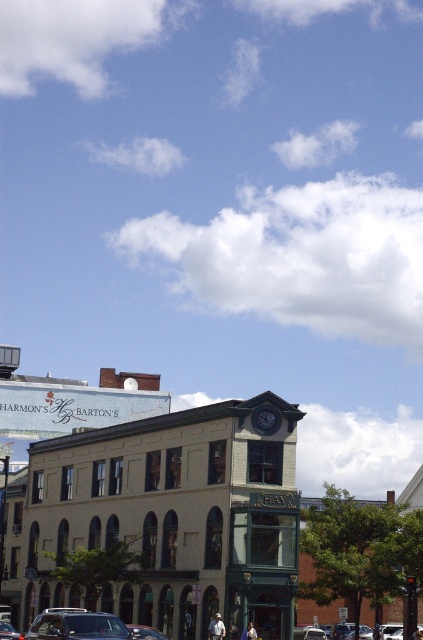
Who is more forward, (46, 637) or (5, 627)?

Point (46, 637) is more forward.

Does metallic silver suv at center have a lesser height compared to metallic silver car at center?

Incorrect, metallic silver suv at center's height does not fall short of metallic silver car at center's.

Locate an element on the screen. The image size is (423, 640). metallic silver suv at center is located at coordinates (85, 625).

Find the location of a particular element. This screenshot has height=640, width=423. metallic silver suv at center is located at coordinates pyautogui.click(x=85, y=625).

Does point (192, 602) come farther from viewer compared to point (10, 630)?

That is True.

Does beige stone building at center have a lesser height compared to metallic silver car at center?

No.

The width and height of the screenshot is (423, 640). In order to click on beige stone building at center in this screenshot , I will do `click(162, 520)`.

Between point (268, 508) and point (121, 634), which one is positioned in front?

Point (121, 634) is more forward.

Is point (153, 456) farther from viewer compared to point (33, 625)?

Yes.

Find the location of `beige stone building at center`. beige stone building at center is located at coordinates (162, 520).